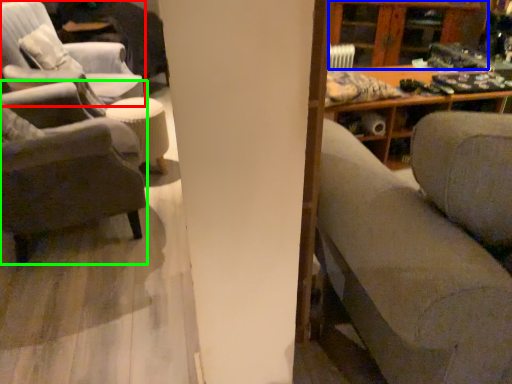
Question: Based on their relative distances, which object is farther from chair (highlighted by a red box)? Choose from shelf (highlighted by a blue box) and chair (highlighted by a green box).

Choices:
 (A) shelf
 (B) chair

Answer: (A)